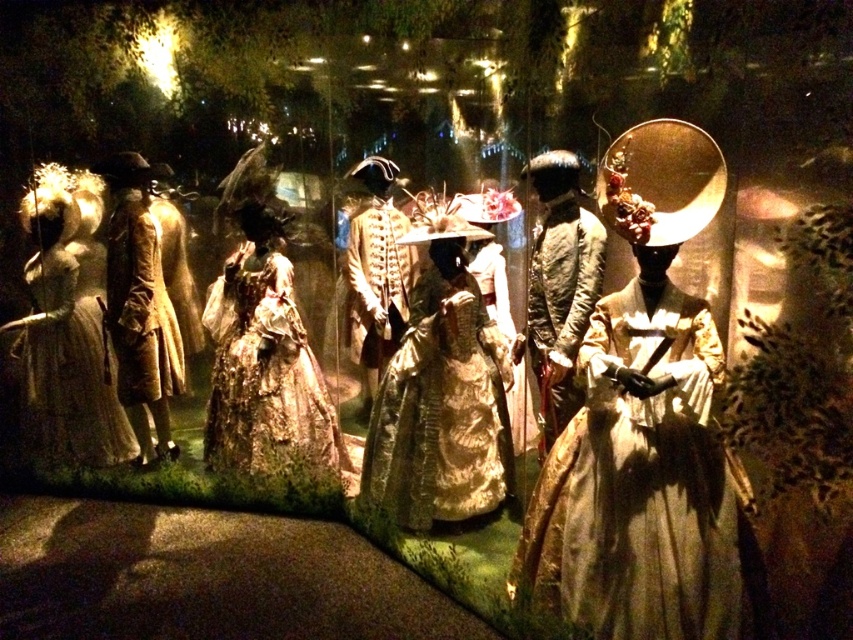
Question: Which of the following is the farthest from the observer?

Choices:
 (A) silvery metallic gown at left
 (B) gold metallic coat at center

Answer: (A)

Question: Among these objects, which one is nearest to the camera?

Choices:
 (A) silvery metallic gown at left
 (B) gold satin dress at center

Answer: (B)

Question: Does silvery satin gown at center appear on the left side of light brown wool coat at left?

Choices:
 (A) yes
 (B) no

Answer: (B)

Question: Is silvery satin gown at center behind gold satin dress at center?

Choices:
 (A) no
 (B) yes

Answer: (A)

Question: Which object appears closest to the camera in this image?

Choices:
 (A) gold metallic coat at center
 (B) shiny gold fabric coat at center
 (C) gold lace gown at center
 (D) silvery metallic gown at left

Answer: (B)

Question: Does gold lace gown at center come behind light brown wool coat at left?

Choices:
 (A) yes
 (B) no

Answer: (B)